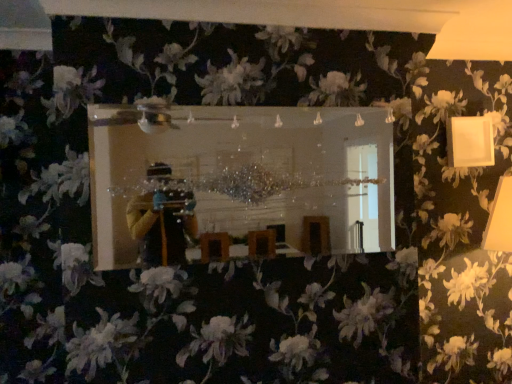
Locate an element on the screen. empty space that is ontop of clear glass mirror at center (from a real-world perspective) is located at coordinates (240, 100).